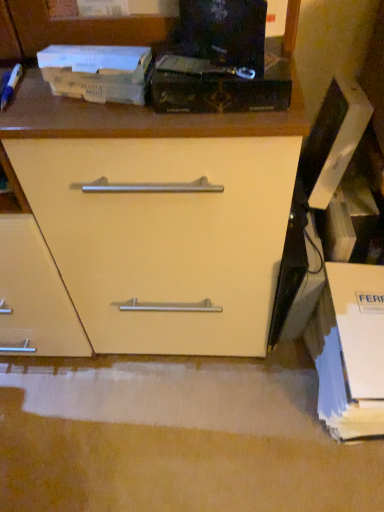
The width and height of the screenshot is (384, 512). I want to click on empty space that is ontop of white cardboard box at lower right (from a real-world perspective), so click(357, 296).